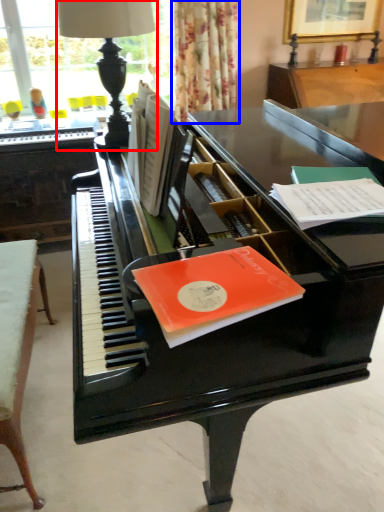
Question: Among these objects, which one is farthest to the camera, table lamp (highlighted by a red box) or curtain (highlighted by a blue box)?

Choices:
 (A) table lamp
 (B) curtain

Answer: (B)